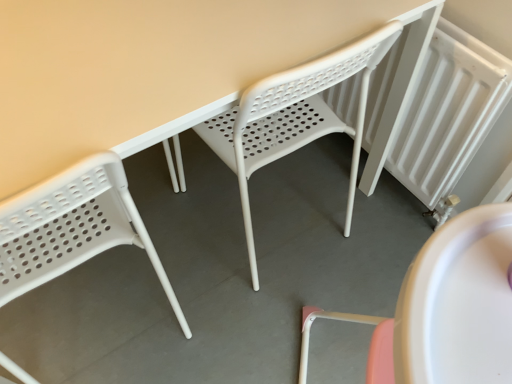
Identify the location of vacant space to the right of white plastic chair at center, which is counted as the second chair, starting from the left. (364, 226).